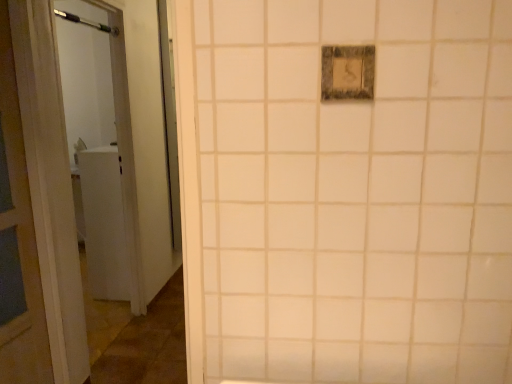
Question: In terms of height, does matte gray switch at upper center look taller or shorter compared to brushed metal shower at upper left?

Choices:
 (A) short
 (B) tall

Answer: (B)

Question: Considering their positions, is matte gray switch at upper center located in front of or behind brushed metal shower at upper left?

Choices:
 (A) front
 (B) behind

Answer: (A)

Question: Which is correct: matte gray switch at upper center is inside brushed metal shower at upper left, or outside of it?

Choices:
 (A) outside
 (B) inside

Answer: (A)

Question: From the image's perspective, is brushed metal shower at upper left located above or below matte gray switch at upper center?

Choices:
 (A) below
 (B) above

Answer: (B)

Question: Is brushed metal shower at upper left inside the boundaries of matte gray switch at upper center, or outside?

Choices:
 (A) outside
 (B) inside

Answer: (A)

Question: From a real-world perspective, is brushed metal shower at upper left above or below matte gray switch at upper center?

Choices:
 (A) below
 (B) above

Answer: (B)

Question: Is brushed metal shower at upper left in front of or behind matte gray switch at upper center in the image?

Choices:
 (A) front
 (B) behind

Answer: (B)